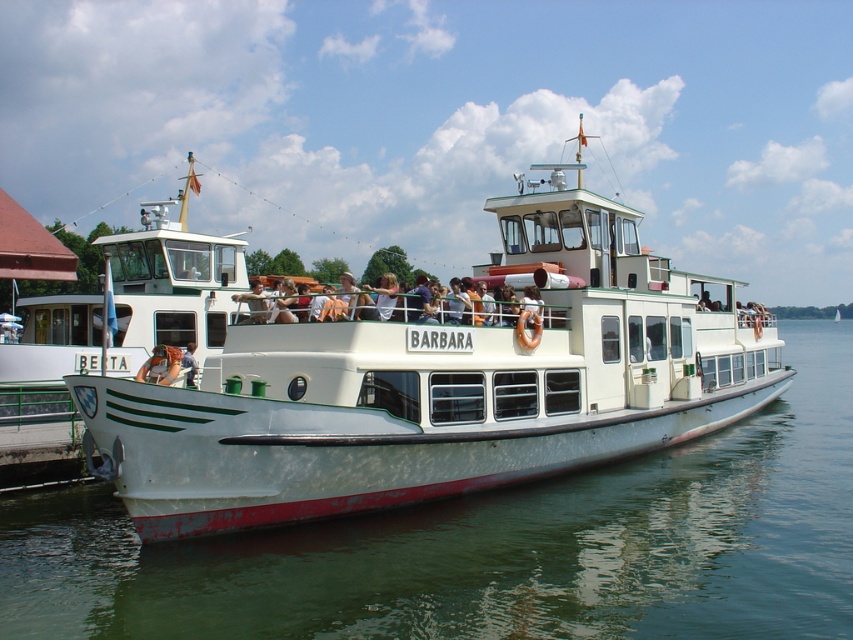
Between white water at center and matte white shirt at center, which one is positioned higher?

matte white shirt at center

Describe the element at coordinates (494, 547) in the screenshot. This screenshot has height=640, width=853. I see `white water at center` at that location.

The height and width of the screenshot is (640, 853). What are the coordinates of `white water at center` in the screenshot? It's located at coord(494,547).

Can you confirm if white matte boat at center is bigger than matte white shirt at center?

Yes, white matte boat at center is bigger than matte white shirt at center.

Can you confirm if white matte boat at center is positioned to the left of matte white shirt at center?

No, white matte boat at center is not to the left of matte white shirt at center.

Where is `white matte boat at center`? white matte boat at center is located at coordinates (442, 385).

Between point (263, 573) and point (602, 289), which one is positioned in front?

Point (263, 573) is more forward.

Between white water at center and white matte boat at center, which one has more height?

With more height is white matte boat at center.

Does point (300, 604) come closer to viewer compared to point (614, 317)?

Yes.

This screenshot has width=853, height=640. In order to click on white water at center in this screenshot , I will do `click(494, 547)`.